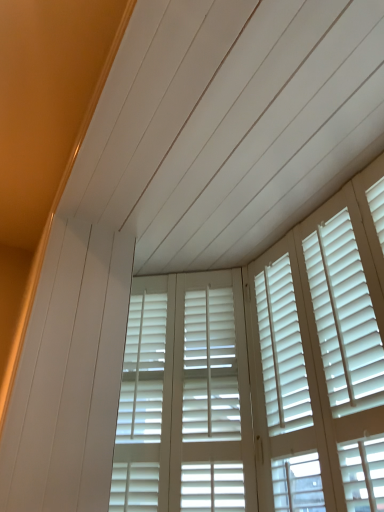
The image size is (384, 512). In order to click on white matte shutters at center in this screenshot , I will do `click(185, 398)`.

The image size is (384, 512). What do you see at coordinates (185, 398) in the screenshot?
I see `white matte shutters at center` at bounding box center [185, 398].

Measure the distance between white matte shutters at center and camera.

They are 1.35 meters apart.

What are the coordinates of `white wood blinds at center` in the screenshot? It's located at (262, 374).

The height and width of the screenshot is (512, 384). What do you see at coordinates (262, 374) in the screenshot?
I see `white wood blinds at center` at bounding box center [262, 374].

I want to click on white matte shutters at center, so click(185, 398).

Which is more to the right, white wood blinds at center or white matte shutters at center?

From the viewer's perspective, white matte shutters at center appears more on the right side.

Is the position of white wood blinds at center more distant than that of white matte shutters at center?

No.

Which is more distant, (339, 486) or (162, 440)?

The point (162, 440) is farther.

From the image's perspective, which object appears higher, white wood blinds at center or white matte shutters at center?

From the image's view, white wood blinds at center is above.

From a real-world perspective, which object stands above the other?

In real-world perspective, white wood blinds at center is above.

In terms of width, does white wood blinds at center look wider or thinner when compared to white matte shutters at center?

Considering their sizes, white wood blinds at center looks slimmer than white matte shutters at center.

Does white wood blinds at center have a lesser height compared to white matte shutters at center?

In fact, white wood blinds at center may be taller than white matte shutters at center.

Considering the sizes of objects white wood blinds at center and white matte shutters at center in the image provided, who is smaller, white wood blinds at center or white matte shutters at center?

Smaller between the two is white matte shutters at center.

Is white wood blinds at center outside of white matte shutters at center?

white wood blinds at center is positioned outside white matte shutters at center.

Are white wood blinds at center and white matte shutters at center located far from each other?

They are positioned close to each other.

Does white wood blinds at center turn towards white matte shutters at center?

No, white wood blinds at center is not aimed at white matte shutters at center.

Can you tell me how much white wood blinds at center and white matte shutters at center differ in facing direction?

They differ by 53.5 degrees in their facing directions.

The image size is (384, 512). I want to click on window positioned vertically above the white matte shutters at center (from a real-world perspective), so 262,374.

Considering the positions of objects white matte shutters at center and white wood blinds at center in the image provided, who is more to the left, white matte shutters at center or white wood blinds at center?

From the viewer's perspective, white wood blinds at center appears more on the left side.

Relative to white wood blinds at center, is white matte shutters at center in front or behind?

In the image, white matte shutters at center appears behind white wood blinds at center.

Considering the points (228, 353) and (372, 371), which point is behind, point (228, 353) or point (372, 371)?

The point (228, 353) is farther.

From the image's perspective, is white matte shutters at center under white wood blinds at center?

Yes, from the image's perspective, white matte shutters at center is beneath white wood blinds at center.

From a real-world perspective, does white matte shutters at center sit lower than white wood blinds at center?

Yes, from a real-world perspective, white matte shutters at center is under white wood blinds at center.

Which object is wider, white matte shutters at center or white wood blinds at center?

With larger width is white matte shutters at center.

Looking at this image, can you confirm if white matte shutters at center is taller than white wood blinds at center?

No, white matte shutters at center is not taller than white wood blinds at center.

Considering the relative sizes of white matte shutters at center and white wood blinds at center in the image provided, is white matte shutters at center smaller than white wood blinds at center?

Yes.

Is white wood blinds at center surrounded by white matte shutters at center?

No, white wood blinds at center is not a part of white matte shutters at center.

Is the surface of white matte shutters at center in direct contact with white wood blinds at center?

No.

Is white matte shutters at center turned away from white wood blinds at center?

white matte shutters at center is not turned away from white wood blinds at center.

Can you tell me how much white matte shutters at center and white wood blinds at center differ in facing direction?

The facing directions of white matte shutters at center and white wood blinds at center are 53.5 degrees apart.

Find the location of a particular element. Image resolution: width=384 pixels, height=512 pixels. window that is on the left side of white matte shutters at center is located at coordinates (262, 374).

Where is `window that appears on the left of white matte shutters at center`? Image resolution: width=384 pixels, height=512 pixels. window that appears on the left of white matte shutters at center is located at coordinates (262, 374).

At what (x,y) coordinates should I click in order to perform the action: click on screen door located below the white wood blinds at center (from the image's perspective). Please return your answer as a coordinate pair (x, y). The image size is (384, 512). Looking at the image, I should click on (185, 398).